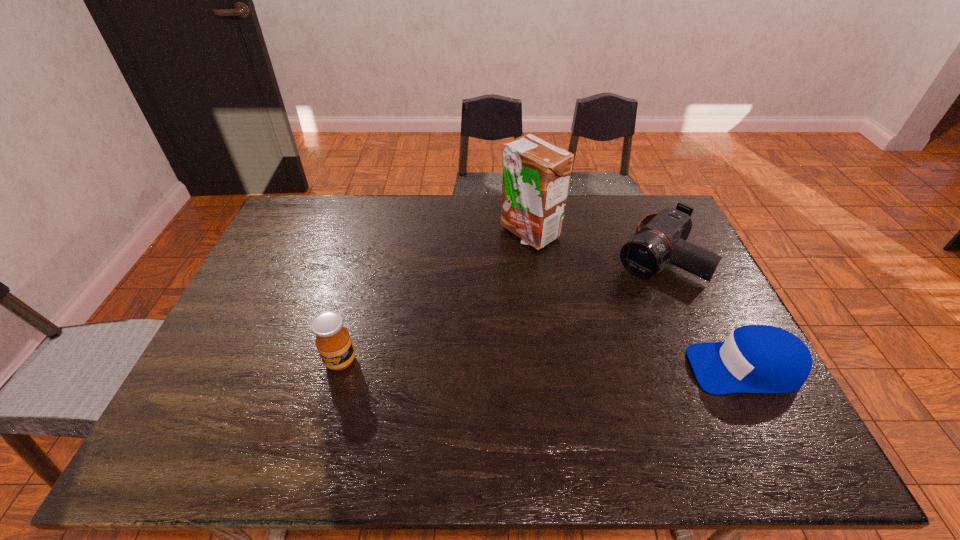
Identify the location of free location that satisfies the following two spatial constraints: 1. on the front side of the baseball cap; 2. on the front-facing side of the camcorder. The image size is (960, 540). (703, 368).

Find the location of a particular element. free space that satisfies the following two spatial constraints: 1. on the front-facing side of the baseball cap; 2. on the front-facing side of the honey is located at coordinates pos(339,368).

This screenshot has height=540, width=960. I want to click on vacant space that satisfies the following two spatial constraints: 1. on the front-facing side of the baseball cap; 2. on the front-facing side of the third shortest object, so click(339, 368).

I want to click on vacant region that satisfies the following two spatial constraints: 1. on the front-facing side of the leftmost object; 2. on the front-facing side of the baseball cap, so click(x=339, y=368).